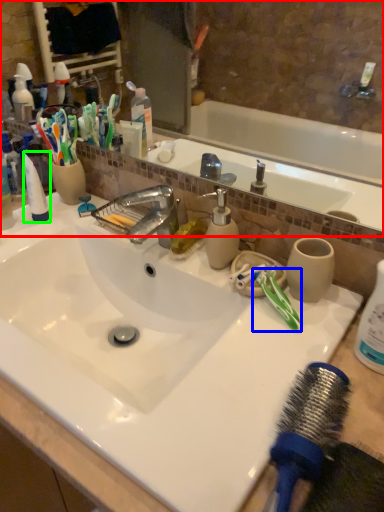
Question: Which is nearer to the mirror (highlighted by a red box)? toothbrush (highlighted by a blue box) or toothpaste (highlighted by a green box).

Choices:
 (A) toothbrush
 (B) toothpaste

Answer: (B)